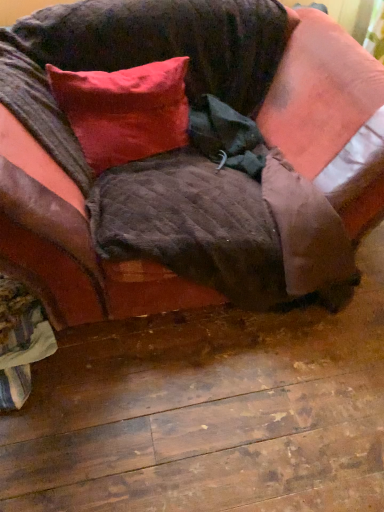
Question: Can you confirm if satin red pillow at upper left is positioned to the left of velvet brown couch at center?

Choices:
 (A) no
 (B) yes

Answer: (B)

Question: Does satin red pillow at upper left have a larger size compared to velvet brown couch at center?

Choices:
 (A) no
 (B) yes

Answer: (A)

Question: From the image's perspective, is satin red pillow at upper left beneath velvet brown couch at center?

Choices:
 (A) yes
 (B) no

Answer: (B)

Question: Would you say satin red pillow at upper left is outside velvet brown couch at center?

Choices:
 (A) yes
 (B) no

Answer: (B)

Question: Is satin red pillow at upper left wider than velvet brown couch at center?

Choices:
 (A) no
 (B) yes

Answer: (A)

Question: Is satin red pillow at upper left facing towards velvet brown couch at center?

Choices:
 (A) yes
 (B) no

Answer: (A)

Question: Does velvet brown couch at center have a smaller size compared to satin red pillow at upper left?

Choices:
 (A) yes
 (B) no

Answer: (B)

Question: Are velvet brown couch at center and satin red pillow at upper left located far from each other?

Choices:
 (A) yes
 (B) no

Answer: (B)

Question: Is velvet brown couch at center aimed at satin red pillow at upper left?

Choices:
 (A) yes
 (B) no

Answer: (A)

Question: Is velvet brown couch at center at the right side of satin red pillow at upper left?

Choices:
 (A) yes
 (B) no

Answer: (A)

Question: Is velvet brown couch at center outside of satin red pillow at upper left?

Choices:
 (A) yes
 (B) no

Answer: (A)

Question: Can you confirm if velvet brown couch at center is thinner than satin red pillow at upper left?

Choices:
 (A) yes
 (B) no

Answer: (B)

Question: Choose the correct answer: Is satin red pillow at upper left inside velvet brown couch at center or outside it?

Choices:
 (A) outside
 (B) inside

Answer: (B)